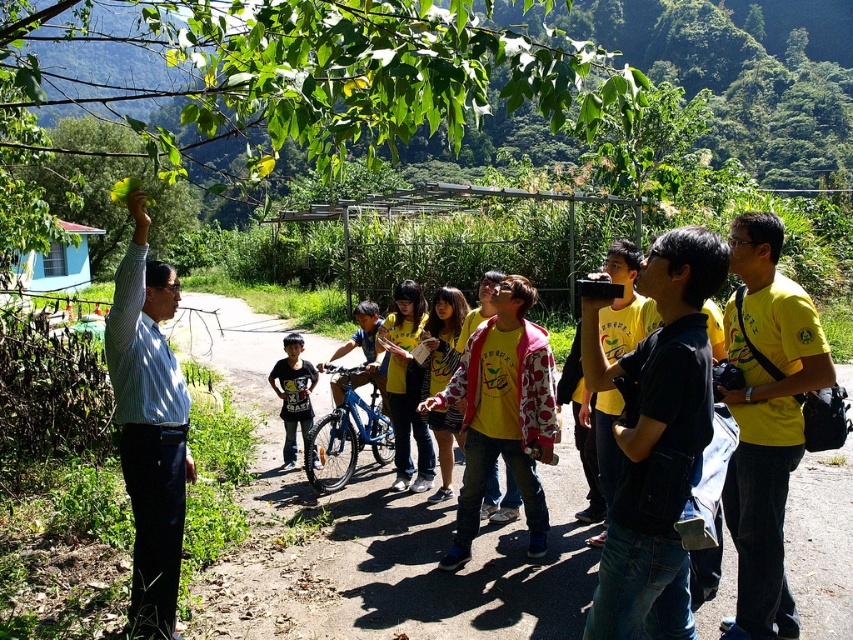
In the scene shown: You are a hiker carrying a 5.5 feet long backpack. You are standing on the brown dirt path at center and want to move to the yellow matte shirt at right. Can your backpack fit through the space between them?

The brown dirt path at center and yellow matte shirt at right are 5.98 feet apart. Since the backpack is 5.5 feet long, it should fit through the space between them as the distance is slightly larger than the backpack.

You are part of the group and want to locate the person wearing the black matte shirt at center and the striped cotton shirt at center. Based on their positions, which one is higher up in the image?

The black matte shirt at center is above the striped cotton shirt at center, so the person wearing the black matte shirt at center is higher up in the image.

You are planning to walk along the brown dirt path at center and the black matte shirt at center. Which one is shorter in length?

The brown dirt path at center is shorter than the black matte shirt at center.